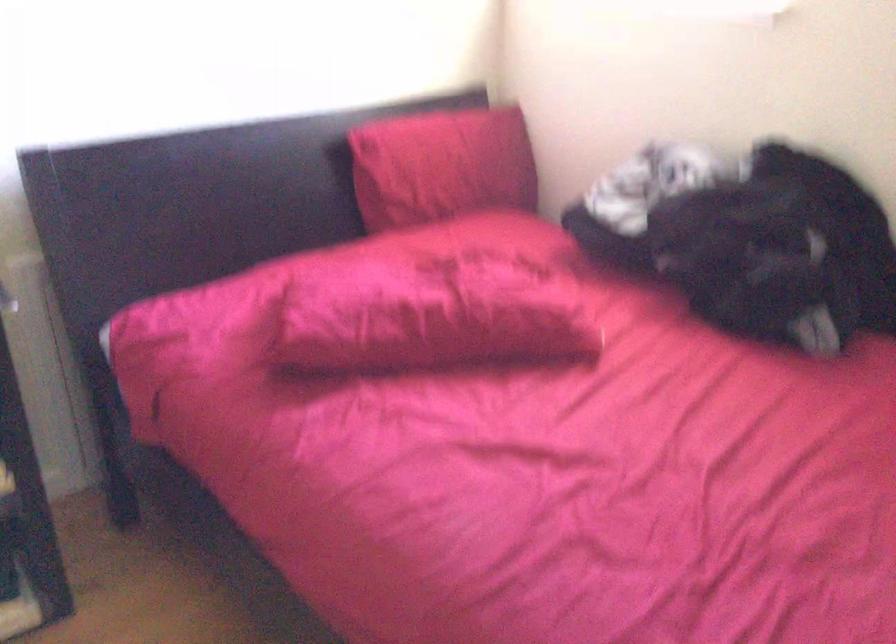
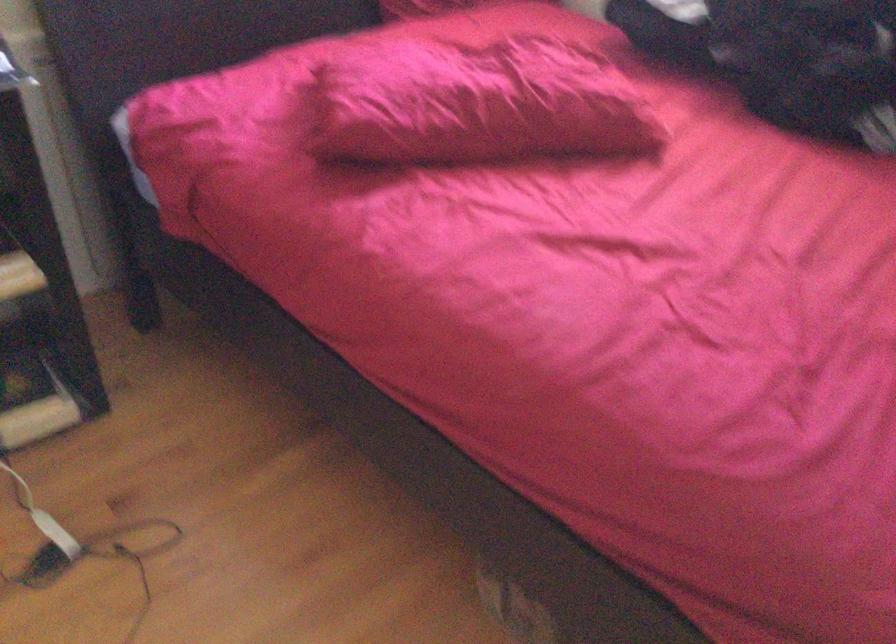
Question: The first image is from the beginning of the video and the second image is from the end. How did the camera likely rotate when shooting the video?

Choices:
 (A) Left
 (B) Right
 (C) Up
 (D) Down

Answer: (D)